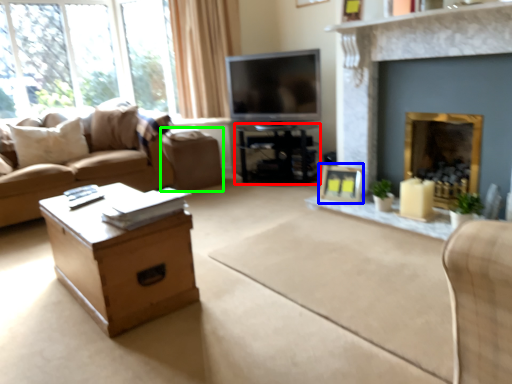
Question: Estimate the real-world distances between objects in this image. Which object is farther from table (highlighted by a red box), picture frame (highlighted by a blue box) or footrest (highlighted by a green box)?

Choices:
 (A) picture frame
 (B) footrest

Answer: (A)